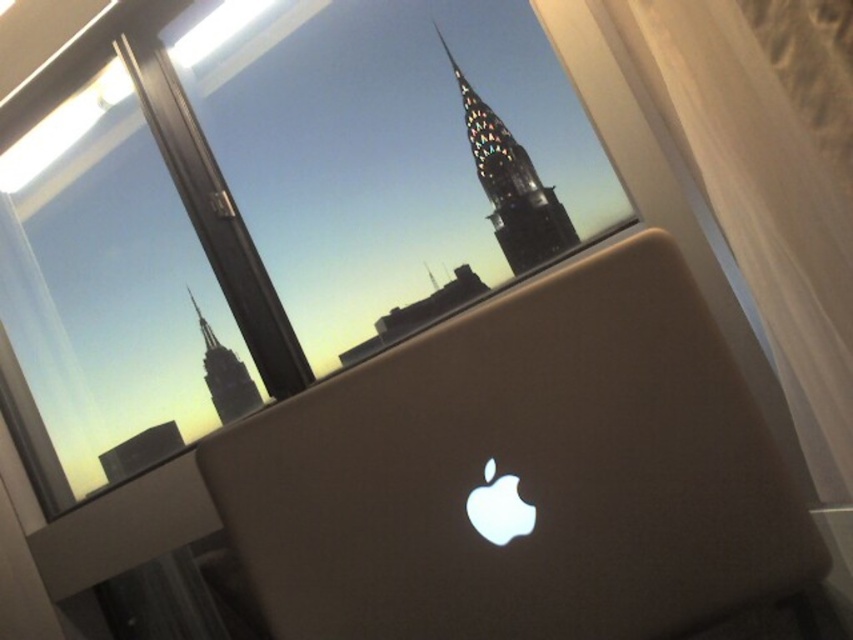
Question: Is satin gold laptop at center positioned before stained glass spire at upper center?

Choices:
 (A) no
 (B) yes

Answer: (B)

Question: Which point is farther to the camera?

Choices:
 (A) dark gray glass skyscraper at center
 (B) stained glass spire at upper center
 (C) satin gold laptop at center

Answer: (A)

Question: Is satin gold laptop at center in front of stained glass spire at upper center?

Choices:
 (A) no
 (B) yes

Answer: (B)

Question: Can you confirm if satin gold laptop at center is wider than dark gray glass skyscraper at center?

Choices:
 (A) yes
 (B) no

Answer: (A)

Question: Which object is farther from the camera taking this photo?

Choices:
 (A) dark gray glass skyscraper at center
 (B) stained glass spire at upper center

Answer: (A)

Question: Which of the following is the farthest from the observer?

Choices:
 (A) satin gold laptop at center
 (B) dark gray glass skyscraper at center

Answer: (B)